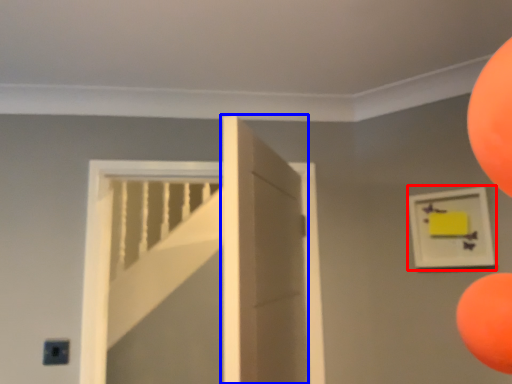
Question: Which of the following is the closest to the observer, picture frame (highlighted by a red box) or door (highlighted by a blue box)?

Choices:
 (A) picture frame
 (B) door

Answer: (B)